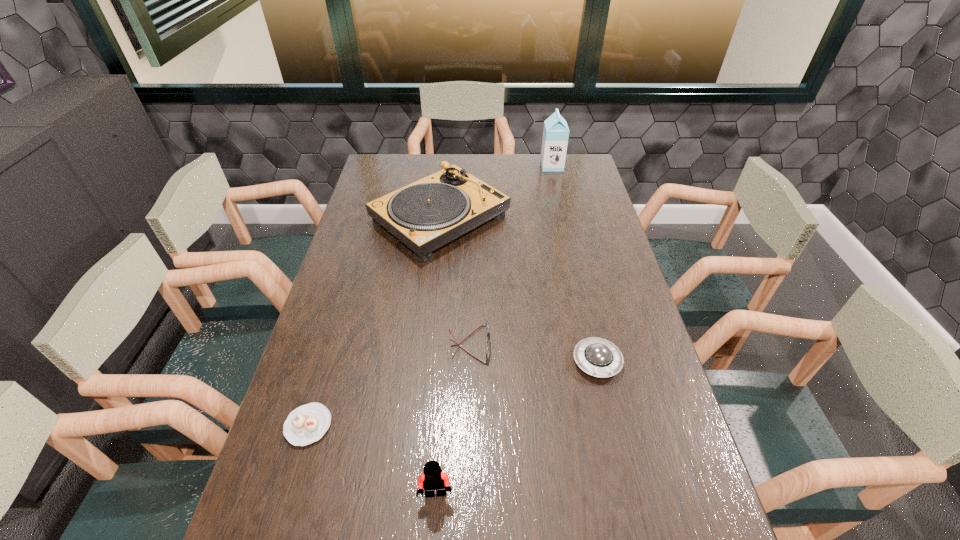
The image size is (960, 540). I want to click on unoccupied area between the fifth nearest object and the spectacles, so click(455, 281).

Locate an element on the screen. free space between the nearest object and the saucer is located at coordinates (516, 428).

Find the location of `free space between the spectacles and the record player`. free space between the spectacles and the record player is located at coordinates (455, 281).

Select which object appears as the second closest to the cupcake. Please provide its 2D coordinates. Your answer should be formatted as a tuple, i.e. [(x, y)], where the tuple contains the x and y coordinates of a point satisfying the conditions above.

[(486, 322)]

Select which object appears as the second closest to the cupcake. Please provide its 2D coordinates. Your answer should be formatted as a tuple, i.e. [(x, y)], where the tuple contains the x and y coordinates of a point satisfying the conditions above.

[(486, 322)]

The width and height of the screenshot is (960, 540). Find the location of `vacant region that satisfies the following two spatial constraints: 1. on the back side of the second farthest object; 2. on the left side of the farthest object`. vacant region that satisfies the following two spatial constraints: 1. on the back side of the second farthest object; 2. on the left side of the farthest object is located at coordinates (445, 166).

Identify the location of free location that satisfies the following two spatial constraints: 1. on the back side of the cupcake; 2. on the right side of the third shortest object. (327, 362).

In order to click on vacant space that satisfies the following two spatial constraints: 1. on the front-facing side of the spectacles; 2. on the left side of the saucer in this screenshot , I will do `click(469, 362)`.

You are a GUI agent. You are given a task and a screenshot of the screen. Output one action in this format:
    pyautogui.click(x=<x>, y=<y>)
    Task: Click on the vacant point that satisfies the following two spatial constraints: 1. on the back side of the cupcake; 2. on the right side of the tallest object
    
    Given the screenshot: What is the action you would take?
    pyautogui.click(x=386, y=166)

Where is `vacant region that satisfies the following two spatial constraints: 1. on the front-facing side of the saucer; 2. on the left side of the spectacles`? The width and height of the screenshot is (960, 540). vacant region that satisfies the following two spatial constraints: 1. on the front-facing side of the saucer; 2. on the left side of the spectacles is located at coordinates (469, 362).